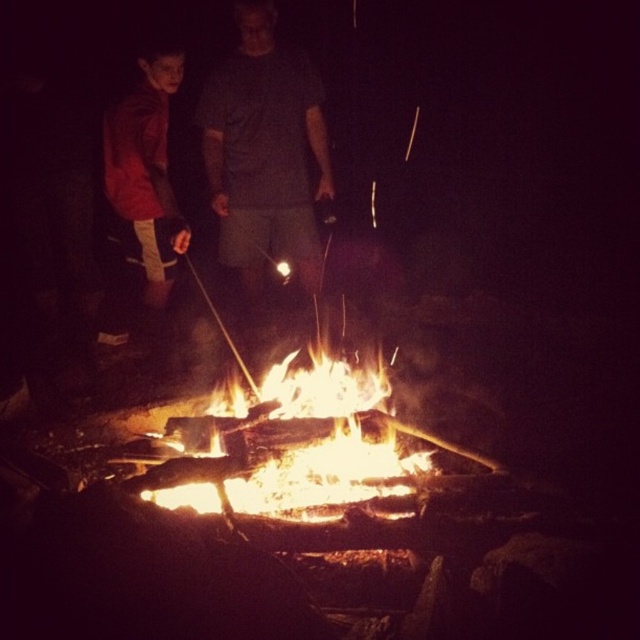
Question: Among these objects, which one is nearest to the camera?

Choices:
 (A) gray cotton shirt at center
 (B) matte red jacket at left

Answer: (B)

Question: Which of these objects is positioned closest to the matte red jacket at left?

Choices:
 (A) gray cotton shirt at center
 (B) flaming wood fire at center

Answer: (A)

Question: Observing the image, what is the correct spatial positioning of flaming wood fire at center in reference to matte red jacket at left?

Choices:
 (A) below
 (B) above

Answer: (A)

Question: Among these objects, which one is nearest to the camera?

Choices:
 (A) flaming wood fire at center
 (B) matte red jacket at left

Answer: (A)

Question: Is gray cotton shirt at center wider than flaming wood fire at center?

Choices:
 (A) yes
 (B) no

Answer: (B)

Question: Can you confirm if gray cotton shirt at center is positioned to the left of matte red jacket at left?

Choices:
 (A) no
 (B) yes

Answer: (A)